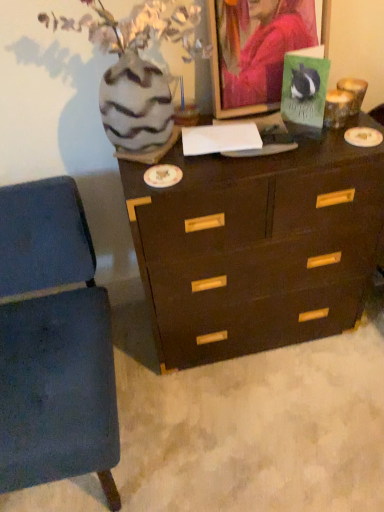
Where is `vacant region to the right of blue fabric chair at lower left`? vacant region to the right of blue fabric chair at lower left is located at coordinates (213, 424).